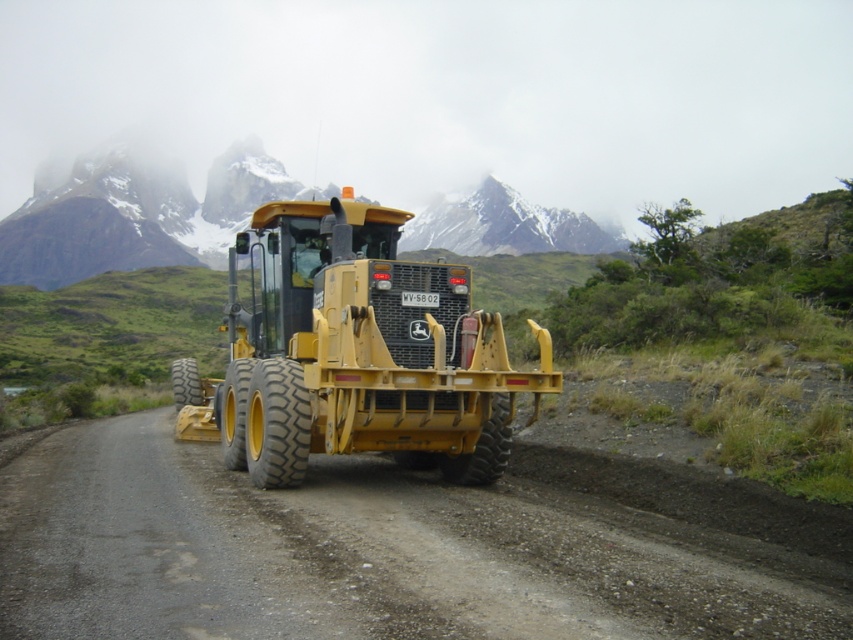
You are a surveyor standing at the point closer to the John Deere grader. Which point are you at, point (32, 582) or point (44, 202)?

You are at point (32, 582) because it is in front of point (44, 202), meaning it is closer to the John Deere grader in the foreground.

You are standing at the point marked as point [392,550] on the dirt track at center. Looking around, you see the yellow road construction vehicle, specifically a John Deere grader, positioned on a dirt road. Which direction should you walk to reach the John Deere grader?

The point [392,550] is on the dirt track at center, so to reach the John Deere grader positioned on the dirt road, you should walk towards the direction where the grader is located along the dirt road.